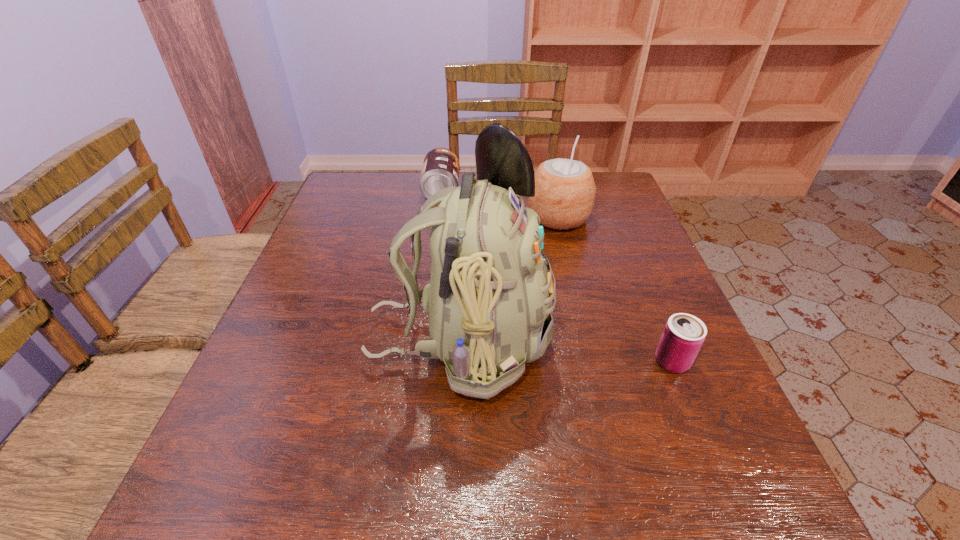
I want to click on blank region between the right can and the coconut, so click(615, 290).

Image resolution: width=960 pixels, height=540 pixels. Identify the location of free area in between the left can and the right can. (557, 276).

Identify the location of blank region between the nearer can and the second tallest object. This screenshot has height=540, width=960. (615, 290).

I want to click on vacant point located between the nearer can and the backpack, so click(565, 351).

Locate an element on the screen. The image size is (960, 540). blank region between the farther can and the right can is located at coordinates (557, 276).

You are a GUI agent. You are given a task and a screenshot of the screen. Output one action in this format:
    pyautogui.click(x=<x>, y=<y>)
    Task: Click on the second closest object to the right can
    The image size is (960, 540).
    Given the screenshot: What is the action you would take?
    pyautogui.click(x=565, y=190)

Where is `object that is the third closest one to the left can`? The image size is (960, 540). object that is the third closest one to the left can is located at coordinates (684, 334).

Locate an element on the screen. The width and height of the screenshot is (960, 540). vacant space that satisfies the following two spatial constraints: 1. on the front label of the left can; 2. on the left side of the rightmost object is located at coordinates (420, 362).

What are the coordinates of `free space that satisfies the following two spatial constraints: 1. on the front label of the nearer can; 2. on the right side of the left can` in the screenshot? It's located at (420, 362).

Image resolution: width=960 pixels, height=540 pixels. Identify the location of free space that satisfies the following two spatial constraints: 1. on the front label of the left can; 2. on the back side of the nearer can. (420, 362).